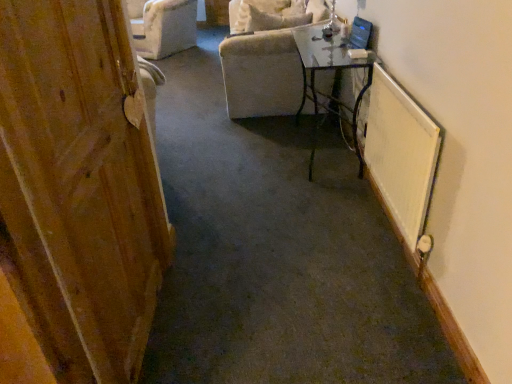
Question: Considering the relative sizes of white textured radiator at right and wooden door at left in the image provided, is white textured radiator at right shorter than wooden door at left?

Choices:
 (A) no
 (B) yes

Answer: (B)

Question: Is white textured radiator at right positioned in front of wooden door at left?

Choices:
 (A) yes
 (B) no

Answer: (B)

Question: Considering the relative sizes of white textured radiator at right and wooden door at left in the image provided, is white textured radiator at right thinner than wooden door at left?

Choices:
 (A) no
 (B) yes

Answer: (A)

Question: Is white textured radiator at right oriented towards wooden door at left?

Choices:
 (A) yes
 (B) no

Answer: (A)

Question: Is white textured radiator at right outside of wooden door at left?

Choices:
 (A) yes
 (B) no

Answer: (A)

Question: Relative to white textured radiator at right, is clear glass table at center in front or behind?

Choices:
 (A) behind
 (B) front

Answer: (A)

Question: Which is correct: clear glass table at center is inside white textured radiator at right, or outside of it?

Choices:
 (A) inside
 (B) outside

Answer: (B)

Question: From a real-world perspective, is clear glass table at center above or below white textured radiator at right?

Choices:
 (A) above
 (B) below

Answer: (B)

Question: From the image's perspective, relative to white textured radiator at right, is clear glass table at center above or below?

Choices:
 (A) below
 (B) above

Answer: (B)

Question: Visually, is velvet beige armchair at upper center positioned to the left or to the right of white textured radiator at right?

Choices:
 (A) right
 (B) left

Answer: (B)

Question: From the image's perspective, is velvet beige armchair at upper center above or below white textured radiator at right?

Choices:
 (A) below
 (B) above

Answer: (B)

Question: From a real-world perspective, is velvet beige armchair at upper center physically located above or below white textured radiator at right?

Choices:
 (A) below
 (B) above

Answer: (B)

Question: Is velvet beige armchair at upper center bigger or smaller than white textured radiator at right?

Choices:
 (A) small
 (B) big

Answer: (B)

Question: From a real-world perspective, is wooden door at left positioned above or below velvet beige armchair at upper center?

Choices:
 (A) above
 (B) below

Answer: (A)

Question: Considering the positions of point (65, 125) and point (267, 110), is point (65, 125) closer or farther from the camera than point (267, 110)?

Choices:
 (A) farther
 (B) closer

Answer: (B)